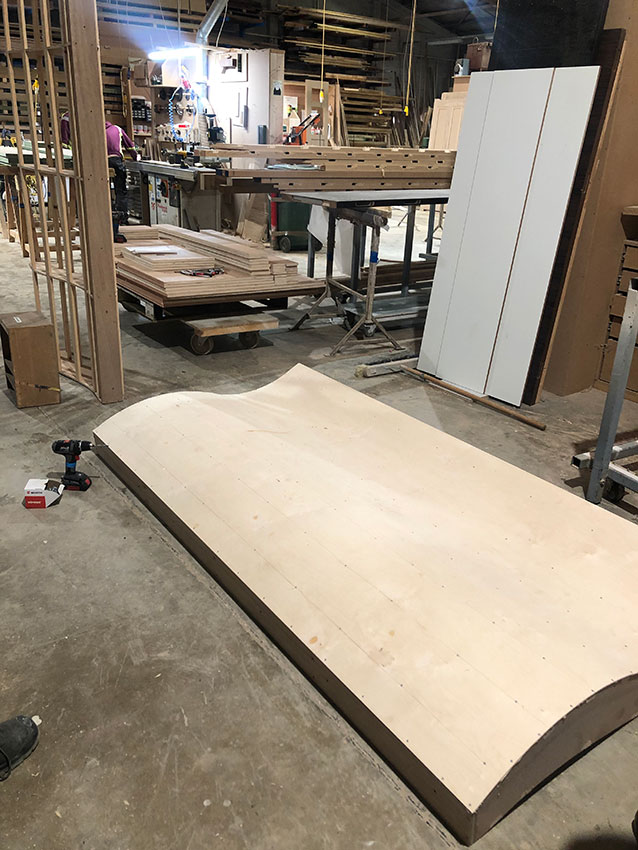
Identify the location of concrete floor. (145, 687).